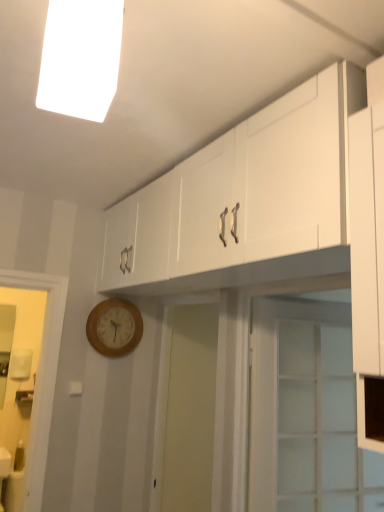
Question: Considering the relative sizes of white fluorescent light at upper center and wooden wall clock at lower left in the image provided, is white fluorescent light at upper center bigger than wooden wall clock at lower left?

Choices:
 (A) no
 (B) yes

Answer: (A)

Question: Is white fluorescent light at upper center not close to wooden wall clock at lower left?

Choices:
 (A) yes
 (B) no

Answer: (A)

Question: Can you confirm if white fluorescent light at upper center is positioned to the right of wooden wall clock at lower left?

Choices:
 (A) no
 (B) yes

Answer: (B)

Question: Does white fluorescent light at upper center have a greater width compared to wooden wall clock at lower left?

Choices:
 (A) no
 (B) yes

Answer: (B)

Question: Considering the relative sizes of white fluorescent light at upper center and wooden wall clock at lower left in the image provided, is white fluorescent light at upper center smaller than wooden wall clock at lower left?

Choices:
 (A) yes
 (B) no

Answer: (A)

Question: Based on their sizes in the image, would you say white fluorescent light at upper center is bigger or smaller than clear glass door at center?

Choices:
 (A) big
 (B) small

Answer: (B)

Question: Considering the positions of point (81, 18) and point (249, 424), is point (81, 18) closer or farther from the camera than point (249, 424)?

Choices:
 (A) closer
 (B) farther

Answer: (A)

Question: Which is correct: white fluorescent light at upper center is inside clear glass door at center, or outside of it?

Choices:
 (A) outside
 (B) inside

Answer: (A)

Question: Looking at their shapes, would you say white fluorescent light at upper center is wider or thinner than clear glass door at center?

Choices:
 (A) wide
 (B) thin

Answer: (A)

Question: Is white glossy cabinet at upper center in front of or behind clear glass door at center in the image?

Choices:
 (A) behind
 (B) front

Answer: (B)

Question: Is white glossy cabinet at upper center taller or shorter than clear glass door at center?

Choices:
 (A) tall
 (B) short

Answer: (B)

Question: In terms of width, does white glossy cabinet at upper center look wider or thinner when compared to clear glass door at center?

Choices:
 (A) thin
 (B) wide

Answer: (B)

Question: Is white glossy cabinet at upper center inside or outside of clear glass door at center?

Choices:
 (A) outside
 (B) inside

Answer: (A)

Question: In terms of height, does wooden wall clock at lower left look taller or shorter compared to white glossy cabinet at upper center?

Choices:
 (A) short
 (B) tall

Answer: (A)

Question: Considering the positions of wooden wall clock at lower left and white glossy cabinet at upper center in the image, is wooden wall clock at lower left wider or thinner than white glossy cabinet at upper center?

Choices:
 (A) thin
 (B) wide

Answer: (A)